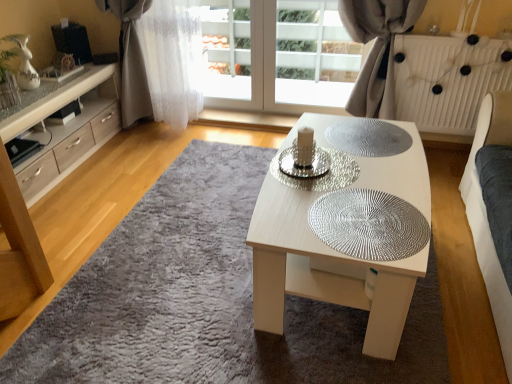
Question: From the image's perspective, is light wood cabinet at left located above or below silver textured mat at center?

Choices:
 (A) below
 (B) above

Answer: (B)

Question: Would you say light wood cabinet at left is to the left or to the right of silver textured mat at center in the picture?

Choices:
 (A) right
 (B) left

Answer: (B)

Question: Estimate the real-world distances between objects in this image. Which object is closer to the light wood cabinet at left?

Choices:
 (A) white sheer curtain at upper left, the 1th curtain in the left-to-right sequence
 (B) silver textured glass plate at center, the second glass plate when ordered from back to front
 (C) silver textured mat at center
 (D) white textured radiator at upper right
 (E) silver textured glass plate at center, marked as the third glass plate in a front-to-back arrangement

Answer: (A)

Question: Which of these objects is positioned closest to the white sheer curtain at upper left, which is the 2th curtain from right to left?

Choices:
 (A) light wood cabinet at left
 (B) silver textured glass plate at center, the 2th glass plate in the front-to-back sequence
 (C) silver textured glass plate at center, positioned as the first glass plate in back-to-front order
 (D) silver textured glass plate at center, the first glass plate when ordered from front to back
 (E) white fabric curtain at upper center, arranged as the 1th curtain when viewed from the right

Answer: (A)